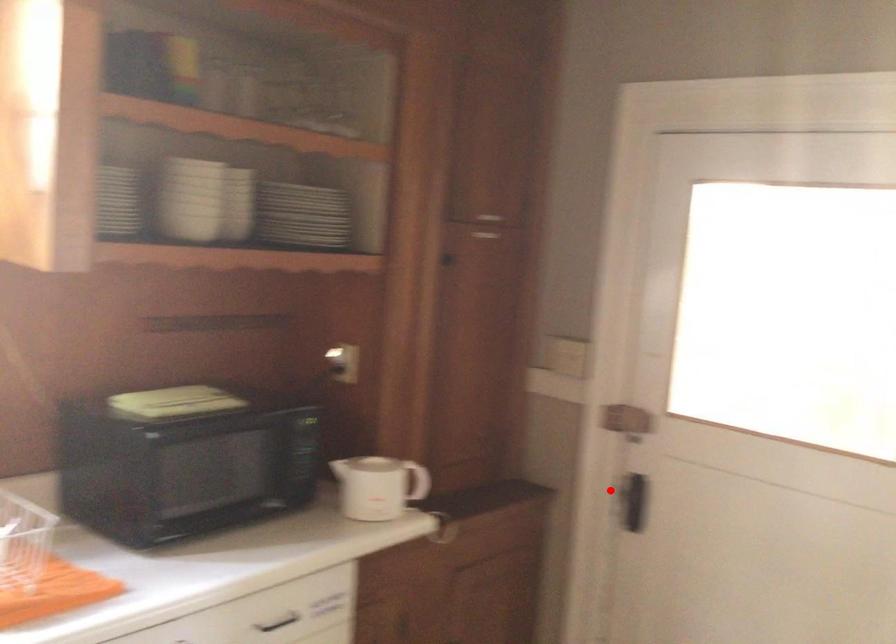
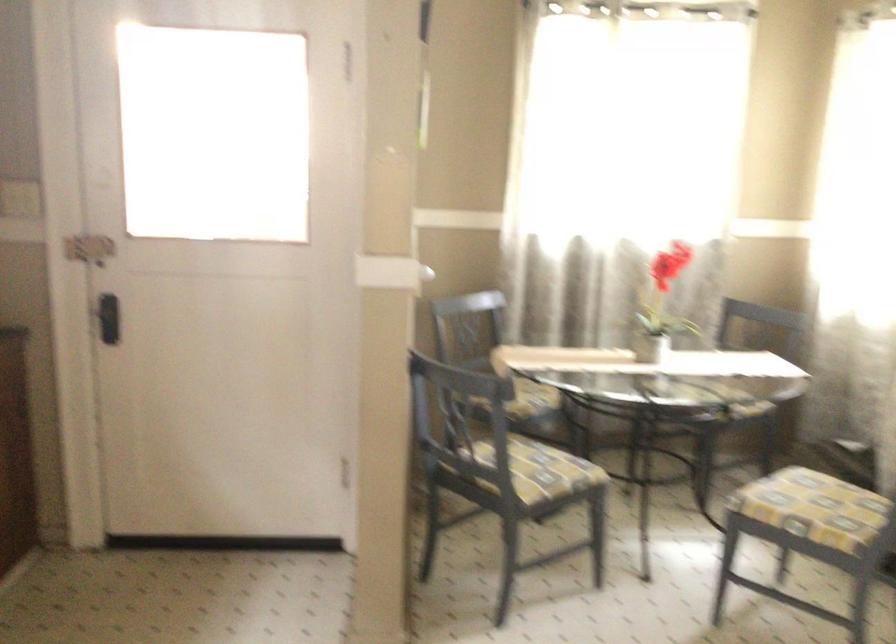
Question: I am providing you with two images of the same scene from different viewpoints. In image1, a red point is highlighted. Considering the same 3D point in image2, which of the following is correct?

Choices:
 (A) It is closer
 (B) It is farther

Answer: (B)